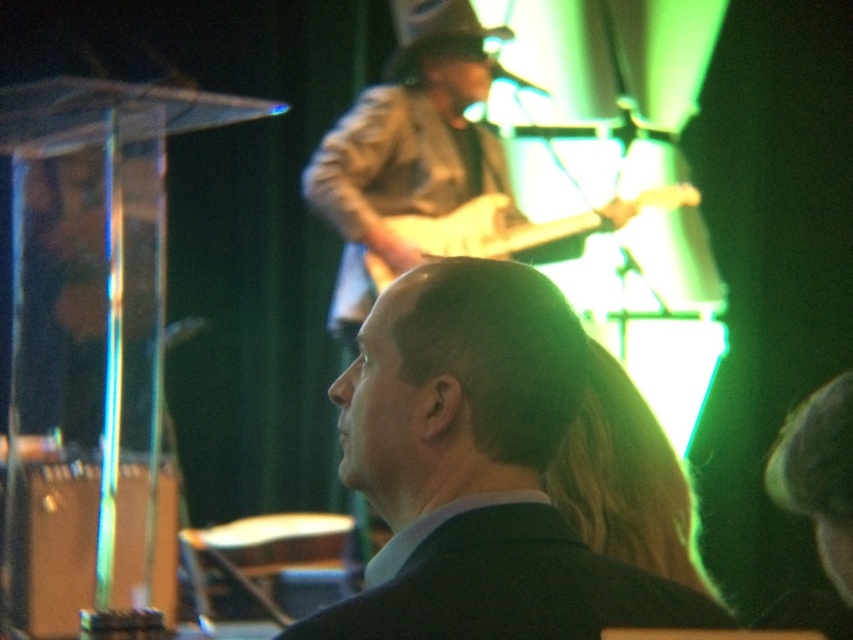
You are a photographer at the concert and want to capture both the black matte suit at center and the light brown wood guitar at center in a single frame. Which object should you focus on first to ensure both are in the frame?

The black matte suit at center is narrower than the light brown wood guitar at center, so you should focus on the light brown wood guitar at center first to ensure both fit within the frame.

You are a photographer at the live music performance. You need to capture a photo where both the black suit at center and the light brown wood guitar at center are clearly visible. Based on their heights, which object might you need to adjust your camera angle to ensure it is fully in frame?

The black suit at center has a lesser height compared to the light brown wood guitar at center. To ensure both are fully visible, you might need to adjust your camera angle to account for the height difference, possibly tilting the camera slightly downward to include the shorter black suit at center while still capturing the taller light brown wood guitar at center.